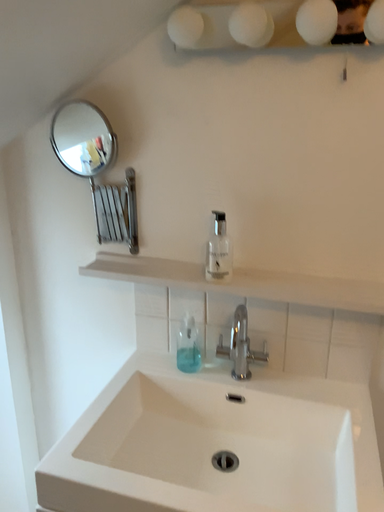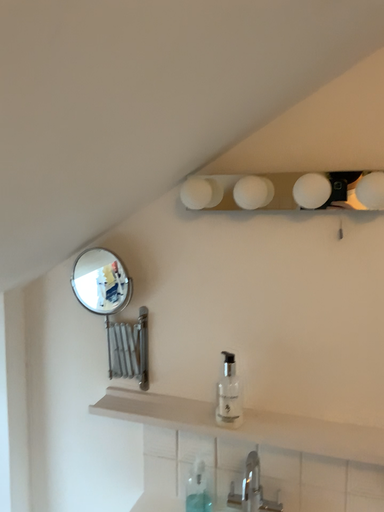
Question: How did the camera likely rotate when shooting the video?

Choices:
 (A) rotated upward
 (B) rotated downward

Answer: (A)